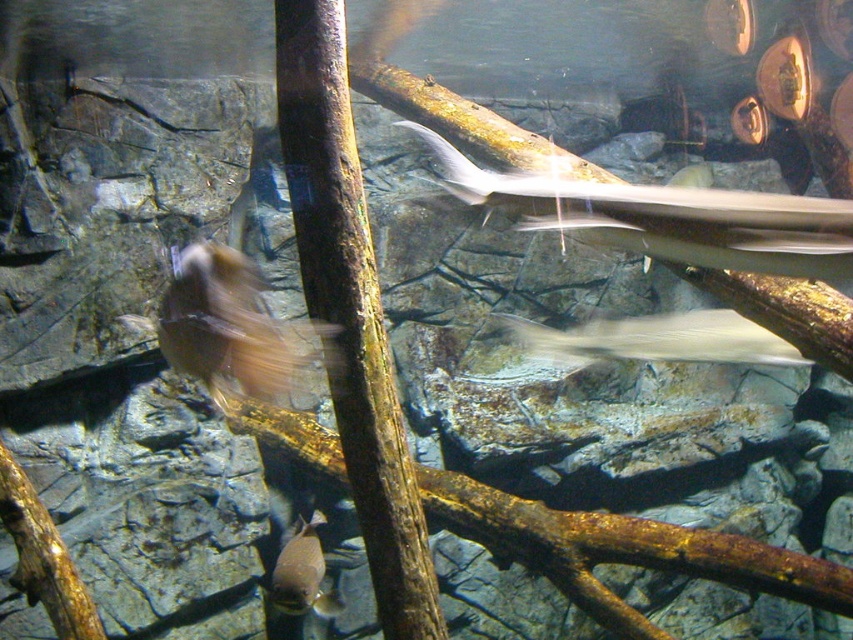
Question: Does translucent white shark at center lie behind shiny silver fish at lower center?

Choices:
 (A) yes
 (B) no

Answer: (B)

Question: Which of the following is the farthest from the observer?

Choices:
 (A) (560, 352)
 (B) (756, 209)

Answer: (A)

Question: Does silvery smooth shark at upper center appear over translucent white shark at center?

Choices:
 (A) no
 (B) yes

Answer: (B)

Question: Can you confirm if silvery smooth shark at upper center is thinner than shiny silver fish at lower center?

Choices:
 (A) no
 (B) yes

Answer: (A)

Question: Which object is closer to the camera taking this photo?

Choices:
 (A) shiny silver fish at lower center
 (B) silvery smooth shark at upper center

Answer: (B)

Question: Estimate the real-world distances between objects in this image. Which object is closer to the silvery smooth shark at upper center?

Choices:
 (A) shiny silver fish at lower center
 (B) translucent white shark at center

Answer: (B)